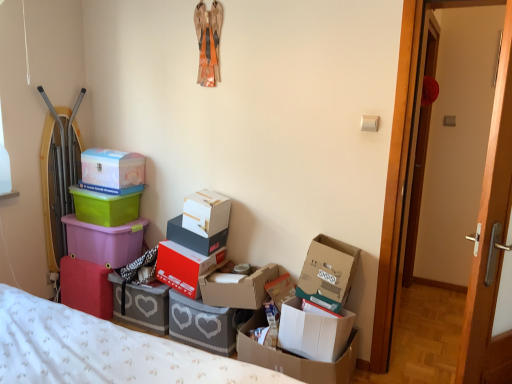
Question: From a real-world perspective, relative to green plastic container at upper left, which is the 2th box from left to right, is white cardboard box at lower right, which ranks as the 11th box in left-to-right order, vertically above or below?

Choices:
 (A) below
 (B) above

Answer: (A)

Question: Is point (300, 319) positioned closer to the camera than point (87, 192)?

Choices:
 (A) closer
 (B) farther

Answer: (A)

Question: Estimate the real-world distances between objects in this image. Which object is farther from the cardboard box at center, acting as the 9th box starting from the left?

Choices:
 (A) white cardboard box at center, which is counted as the sixth box, starting from the right
 (B) matte white cardboard box at center, the seventh box viewed from the right
 (C) matte wood door at right, which ranks as the second door in back-to-front order
 (D) matte white plastic box at upper left, acting as the tenth box starting from the right
 (E) gray cardboard box at lower center, positioned as the 4th box in left-to-right order

Answer: (C)

Question: Considering the real-world distances, which object is farthest from the white cardboard box at center, the 7th box viewed from the left?

Choices:
 (A) cardboard box at center, which ranks as the fourth box in right-to-left order
 (B) red matte shoebox at center, which appears as the eighth box when viewed from the right
 (C) gray cardboard box at center, positioned as the 5th box in right-to-left order
 (D) green plastic container at upper left, positioned as the 11th box in right-to-left order
 (E) white cardboard box at lower right, the second box when ordered from right to left

Answer: (E)